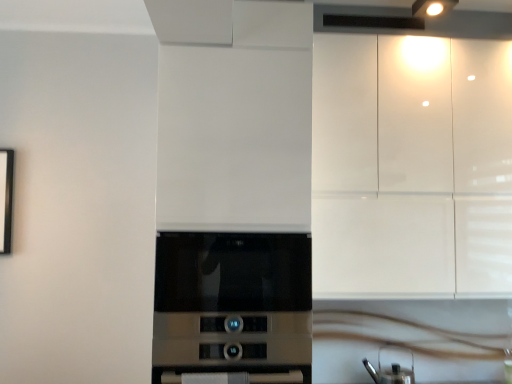
Question: Looking at their shapes, would you say satin silver microwave at center is wider or thinner than white glossy countertop at lower center?

Choices:
 (A) wide
 (B) thin

Answer: (A)

Question: In terms of height, does satin silver microwave at center look taller or shorter compared to white glossy countertop at lower center?

Choices:
 (A) tall
 (B) short

Answer: (A)

Question: Which object is the farthest from the glossy white cabinets at upper right?

Choices:
 (A) white glossy countertop at lower center
 (B) metallic silver kettle at lower right
 (C) satin silver microwave at center

Answer: (A)

Question: Estimate the real-world distances between objects in this image. Which object is closer to the satin silver microwave at center?

Choices:
 (A) glossy white cabinets at upper right
 (B) white glossy countertop at lower center
 (C) metallic silver kettle at lower right

Answer: (A)